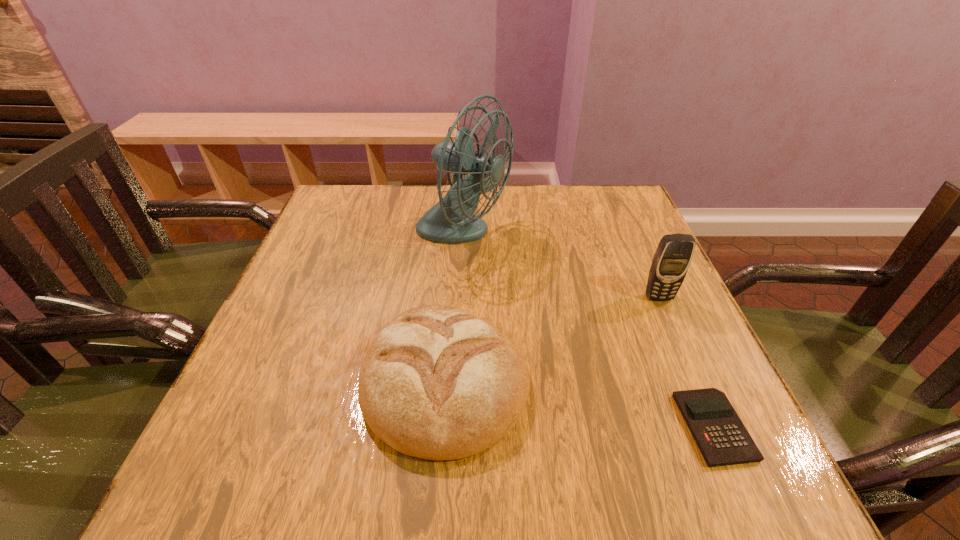
Identify the location of object that is at the far edge. (450, 221).

Find the location of a particular element. bread present at the near edge is located at coordinates (438, 383).

At what (x,y) coordinates should I click in order to perform the action: click on calculator present at the near edge. Please return your answer as a coordinate pair (x, y). Image resolution: width=960 pixels, height=540 pixels. Looking at the image, I should click on (722, 438).

Find the location of a particular element. The width and height of the screenshot is (960, 540). cellular telephone positioned at the right edge is located at coordinates (673, 256).

I want to click on calculator at the right edge, so click(x=722, y=438).

Image resolution: width=960 pixels, height=540 pixels. In order to click on object that is at the near right corner in this screenshot , I will do `click(722, 438)`.

Image resolution: width=960 pixels, height=540 pixels. Identify the location of vacant space at the far edge of the desktop. (429, 195).

The width and height of the screenshot is (960, 540). In order to click on vacant area at the near edge in this screenshot , I will do `click(395, 463)`.

In the image, there is a desktop. What are the coordinates of `vacant space at the left edge` in the screenshot? It's located at (360, 279).

The image size is (960, 540). Find the location of `free point at the right edge`. free point at the right edge is located at coordinates (644, 314).